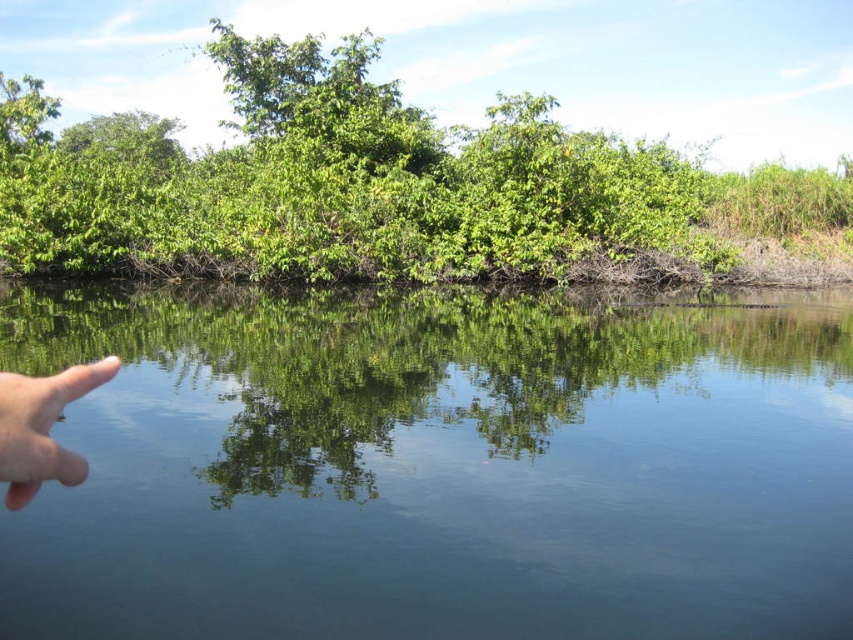
Question: In this image, where is transparent water at center located relative to green leafy bush at upper center?

Choices:
 (A) left
 (B) right

Answer: (A)

Question: Estimate the real-world distances between objects in this image. Which object is closer to the transparent water at center?

Choices:
 (A) flesh-toned skin at left
 (B) green leafy bush at upper center

Answer: (A)

Question: Estimate the real-world distances between objects in this image. Which object is farther from the flesh-toned skin at left?

Choices:
 (A) transparent water at center
 (B) green leafy bush at upper center

Answer: (B)

Question: Can you confirm if transparent water at center is smaller than green leafy bush at upper center?

Choices:
 (A) yes
 (B) no

Answer: (A)

Question: Does green leafy bush at upper center have a smaller size compared to flesh-toned skin at left?

Choices:
 (A) yes
 (B) no

Answer: (B)

Question: Considering the real-world distances, which object is closest to the green leafy bush at upper center?

Choices:
 (A) transparent water at center
 (B) flesh-toned skin at left

Answer: (A)